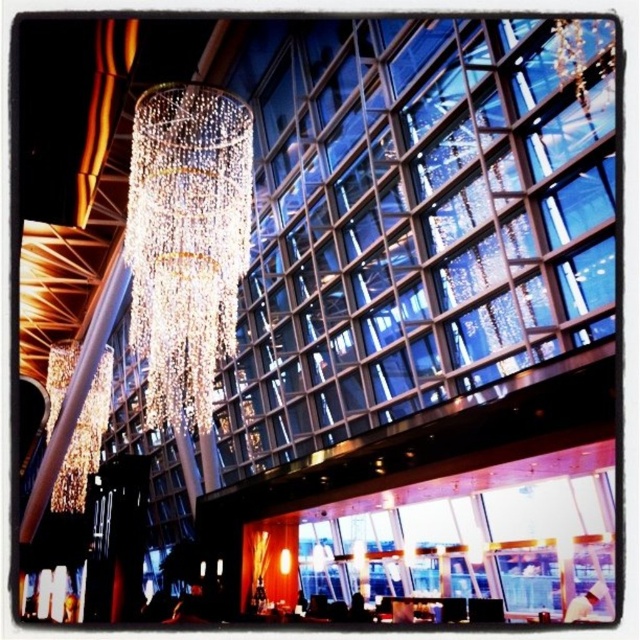
Is clear crystal chandelier at center to the left of iridescent glass chandelier at upper center from the viewer's perspective?

No, clear crystal chandelier at center is not to the left of iridescent glass chandelier at upper center.

Is point (138, 228) closer to viewer compared to point (60, 497)?

Yes, point (138, 228) is closer to viewer.

Image resolution: width=640 pixels, height=640 pixels. I want to click on clear crystal chandelier at center, so click(x=186, y=241).